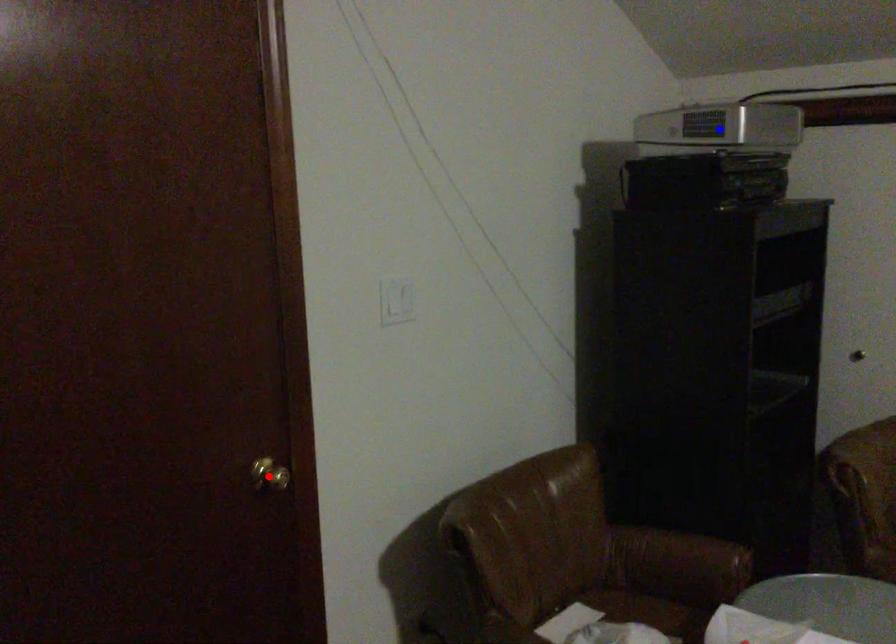
Question: Two points are marked on the image. Which point is closer to the camera?

Choices:
 (A) Blue point is closer.
 (B) Red point is closer.

Answer: (B)